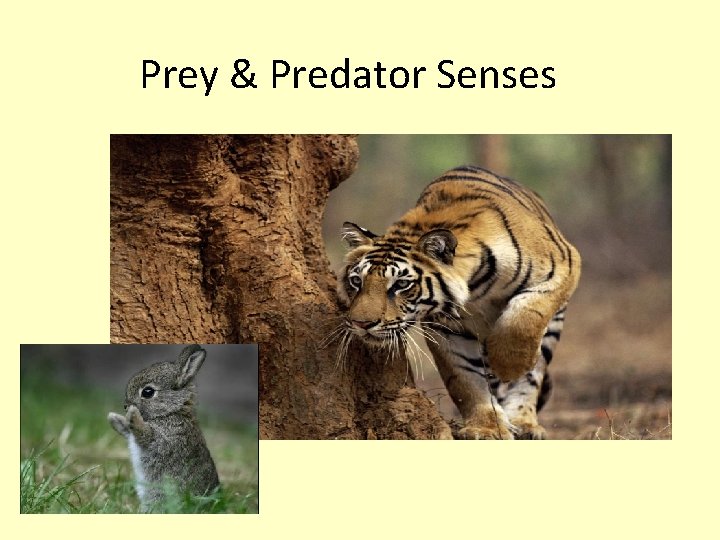
The height and width of the screenshot is (540, 720). In order to click on right front leg in this screenshot , I will do `click(467, 384)`.